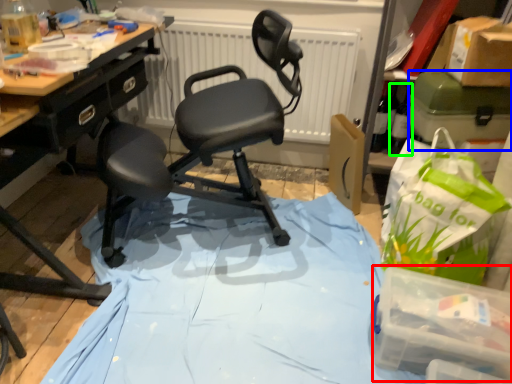
Question: Which object is the closest to the box (highlighted by a red box)? Choose among these: box (highlighted by a blue box) or bottle (highlighted by a green box).

Choices:
 (A) box
 (B) bottle

Answer: (A)